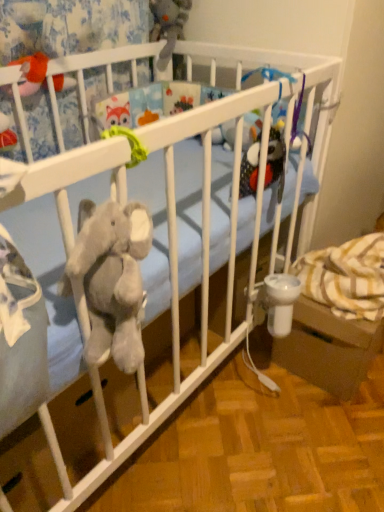
The image size is (384, 512). Identify the location of space that is in front of white plastic baby carriage at lower right. (325, 433).